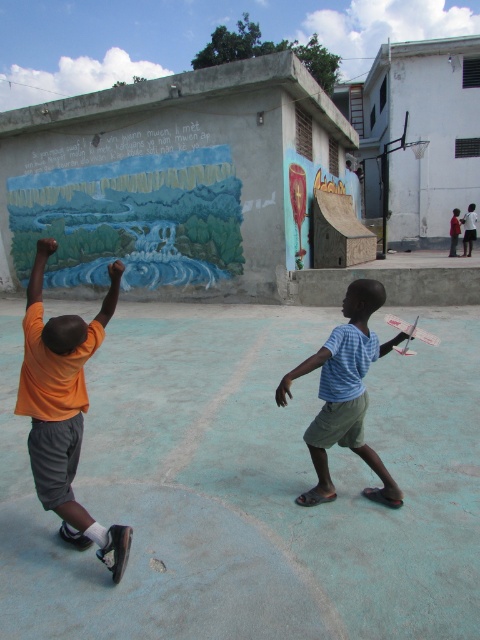
Who is lower down, orange matte shirt at upper left or blue striped shirt at center?

Positioned lower is blue striped shirt at center.

Is orange matte shirt at upper left below blue striped shirt at center?

Incorrect, orange matte shirt at upper left is not positioned below blue striped shirt at center.

You are a GUI agent. You are given a task and a screenshot of the screen. Output one action in this format:
    pyautogui.click(x=<x>, y=<y>)
    Task: Click on the orange matte shirt at upper left
    
    Given the screenshot: What is the action you would take?
    pyautogui.click(x=63, y=408)